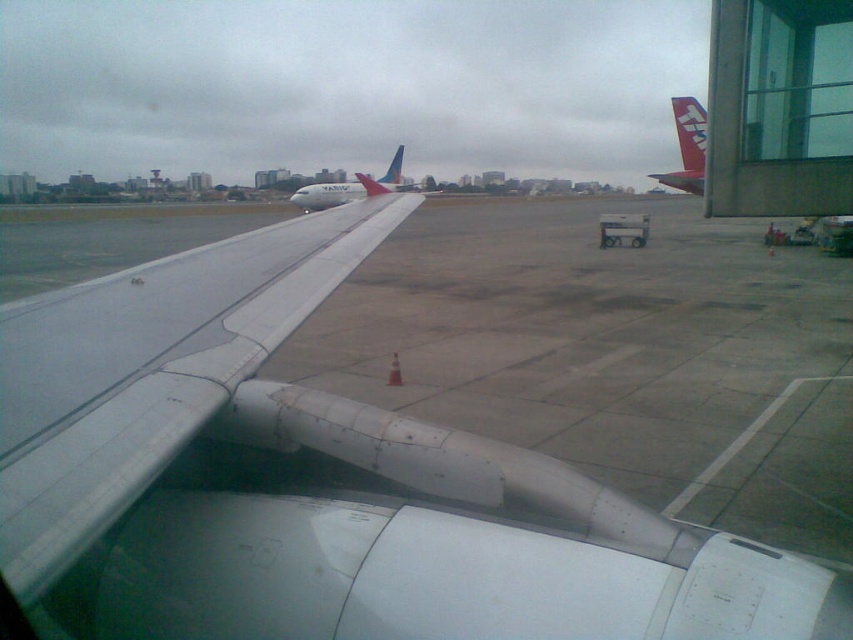
Question: Which point is closer to the camera?

Choices:
 (A) metallic silver wing at center
 (B) matte red tail at upper right

Answer: (A)

Question: Which of the following is the farthest from the observer?

Choices:
 (A) matte red tail at upper right
 (B) white glossy airplane at center
 (C) metallic gray wing at center
 (D) metallic silver wing at center

Answer: (B)

Question: Does metallic gray wing at center have a smaller size compared to white glossy airplane at center?

Choices:
 (A) yes
 (B) no

Answer: (A)

Question: Is metallic silver wing at center closer to the viewer compared to matte red tail at upper right?

Choices:
 (A) yes
 (B) no

Answer: (A)

Question: Does metallic silver wing at center have a lesser width compared to white glossy airplane at center?

Choices:
 (A) no
 (B) yes

Answer: (B)

Question: Which object is positioned farthest from the white glossy airplane at center?

Choices:
 (A) matte red tail at upper right
 (B) metallic silver wing at center

Answer: (B)